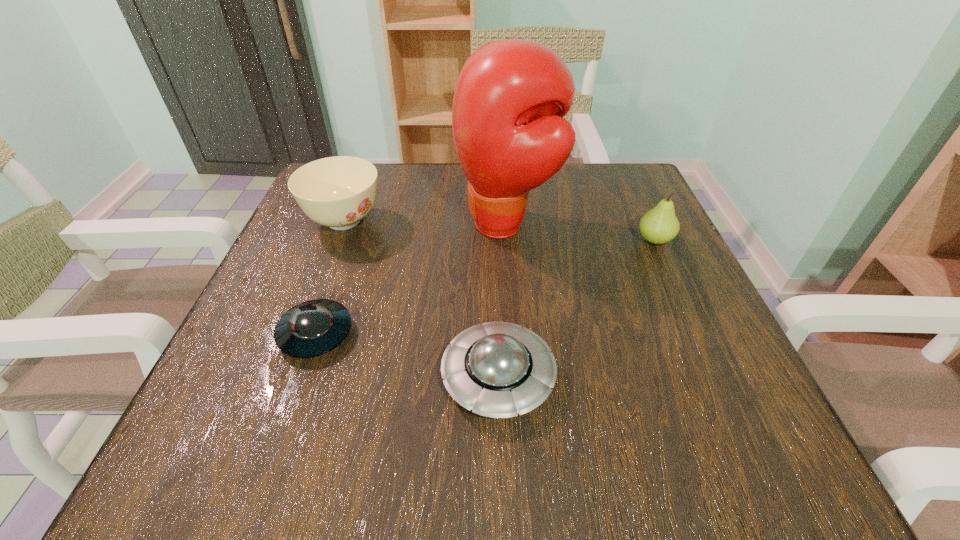
Find the location of a particular element. The image size is (960, 540). vacant area that lies between the fourth tallest object and the sugar bowl is located at coordinates (421, 299).

Where is `vacant area that lies between the tallest object and the sugar bowl`? vacant area that lies between the tallest object and the sugar bowl is located at coordinates (425, 223).

Identify the location of free spot between the shortest object and the pear. The height and width of the screenshot is (540, 960). (485, 287).

The height and width of the screenshot is (540, 960). I want to click on unoccupied position between the shortest object and the boxing glove, so click(x=411, y=279).

Locate an element on the screen. The image size is (960, 540). empty space between the left saucer and the pear is located at coordinates (485, 287).

Where is `blank region between the rightmost object and the shorter saucer`? blank region between the rightmost object and the shorter saucer is located at coordinates (485, 287).

Where is `vacant region between the sugar bowl and the tallest object`? The width and height of the screenshot is (960, 540). vacant region between the sugar bowl and the tallest object is located at coordinates (425, 223).

Point out which object is positioned as the second nearest to the shortest object. Please provide its 2D coordinates. Your answer should be formatted as a tuple, i.e. [(x, y)], where the tuple contains the x and y coordinates of a point satisfying the conditions above.

[(338, 192)]

Locate an element on the screen. The height and width of the screenshot is (540, 960). the third closest object to the sugar bowl is located at coordinates (498, 369).